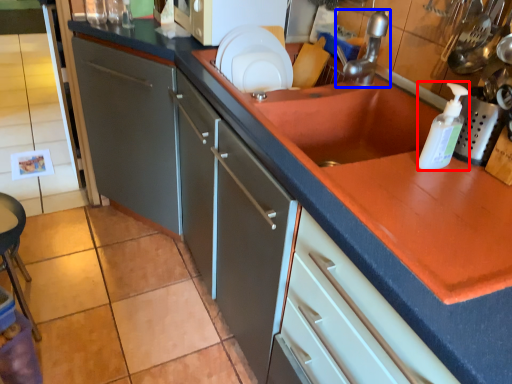
Question: Among these objects, which one is farthest to the camera, bottle (highlighted by a red box) or tap (highlighted by a blue box)?

Choices:
 (A) bottle
 (B) tap

Answer: (B)